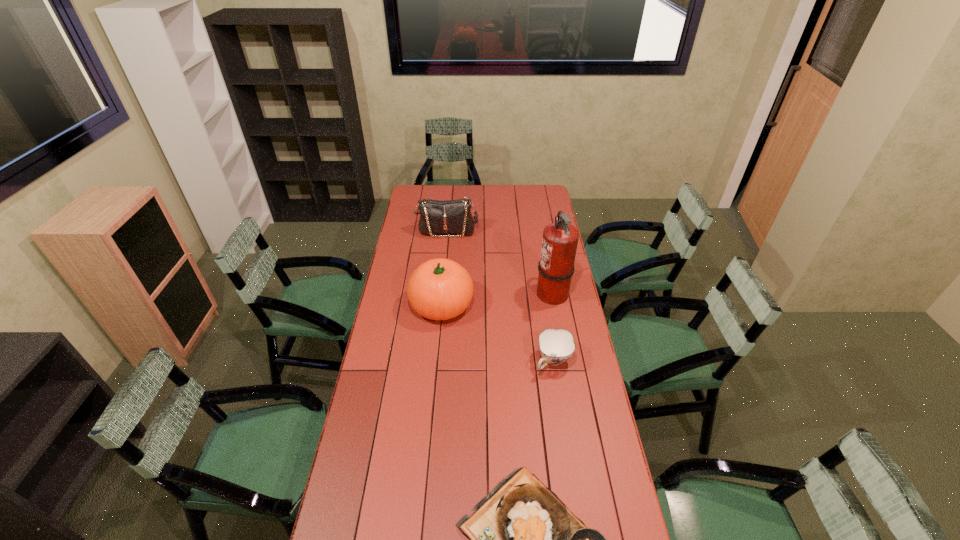
Identify the location of fire extinguisher. This screenshot has height=540, width=960. (556, 267).

Image resolution: width=960 pixels, height=540 pixels. What are the coordinates of `pumpkin` in the screenshot? It's located at (439, 289).

Identify the location of the third tallest object. (450, 216).

You are a GUI agent. You are given a task and a screenshot of the screen. Output one action in this format:
    pyautogui.click(x=<x>, y=<y>)
    Task: Click on the handbag
    This screenshot has height=540, width=960.
    Given the screenshot: What is the action you would take?
    pyautogui.click(x=450, y=216)

Locate an element on the screen. This screenshot has height=540, width=960. the fourth farthest object is located at coordinates (556, 346).

Locate an element on the screen. This screenshot has height=540, width=960. the second shortest object is located at coordinates (556, 346).

This screenshot has width=960, height=540. Identify the location of vacant space located 0.220m toward the nozzle of the tallest object. (489, 293).

Where is `vacant area situated 0.300m toward the nozzle of the tallest object`? The image size is (960, 540). vacant area situated 0.300m toward the nozzle of the tallest object is located at coordinates (471, 293).

At what (x,y) coordinates should I click in order to perform the action: click on vacant space located 0.340m toward the nozzle of the tallest object. Please return your answer as a coordinate pair (x, y). The height and width of the screenshot is (540, 960). Looking at the image, I should click on (463, 293).

In order to click on free region located on the front of the pumpkin in this screenshot , I will do `click(435, 381)`.